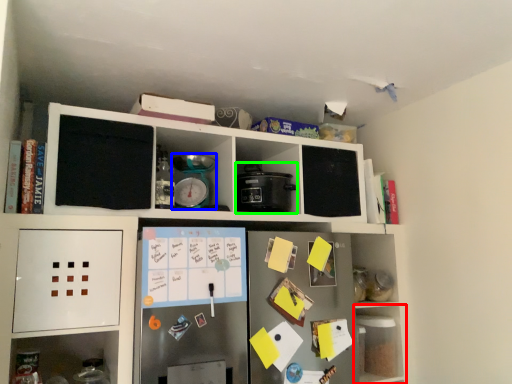
Question: Which is nearer to the shelf (highlighted by a red box)? appliance (highlighted by a blue box) or appliance (highlighted by a green box).

Choices:
 (A) appliance
 (B) appliance

Answer: (B)